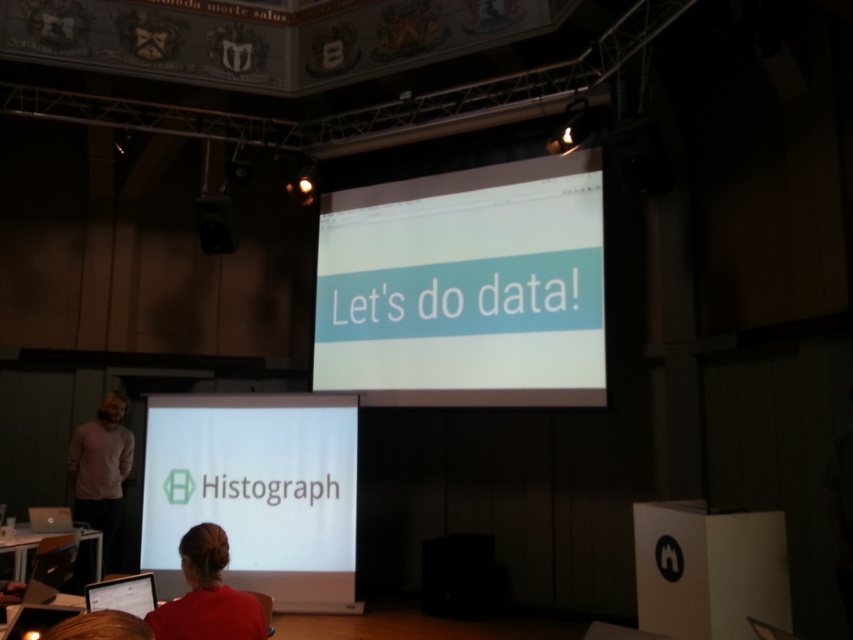
You are an attendee at the presentation and need to access the laptop to adjust the slides. Can you reach the matte black laptop at lower left while standing behind the red fabric shirt at lower center?

The red fabric shirt at lower center is positioned over the matte black laptop at lower left, which means the laptop is currently blocked by the shirt. You would need to move the shirt or ask the person wearing it to step aside to access the laptop.

You are an event organizer setting up for a presentation. You have two screens, the white glossy projector screen at center and the white matte projection screen at center. According to the scene description, which screen is positioned to the right?

The white glossy projector screen at center is to the right of the white matte projection screen at center.

You are sitting in the front row of the conference hall and want to take a photo of both the white glossy projector screen at center and the white matte projection screen at center. Which screen will appear larger in your photo?

The white glossy projector screen at center will appear larger in the photo because it is closer to the viewer than the white matte projection screen at center.